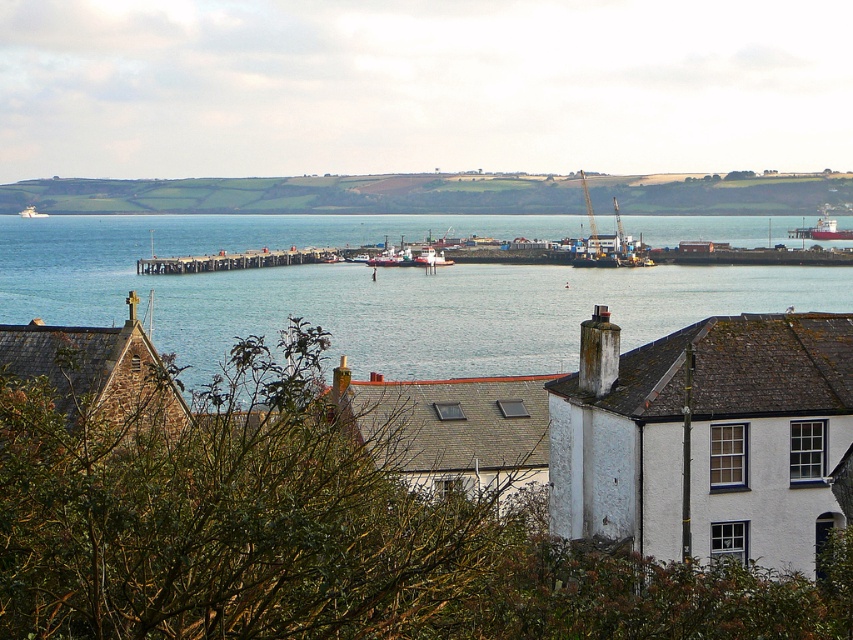
Is green grassy hillside at upper center taller than metallic industrial crane at center?

No, green grassy hillside at upper center is not taller than metallic industrial crane at center.

Is point (592, 195) in front of point (621, 234)?

No, it is not.

Locate an element on the screen. green grassy hillside at upper center is located at coordinates (300, 195).

In the scene shown: Does metallic industrial crane at center appear under white plastic boat at center?

Incorrect, metallic industrial crane at center is not positioned below white plastic boat at center.

Does point (614, 209) come closer to viewer compared to point (393, 257)?

No, (614, 209) is behind (393, 257).

This screenshot has width=853, height=640. In order to click on metallic industrial crane at center in this screenshot , I will do `click(608, 246)`.

Can you confirm if white textured building at center is positioned above metallic industrial crane at center?

No, white textured building at center is not above metallic industrial crane at center.

Is point (758, 321) farther from viewer compared to point (578, 257)?

That is False.

Locate an element on the screen. white textured building at center is located at coordinates (648, 435).